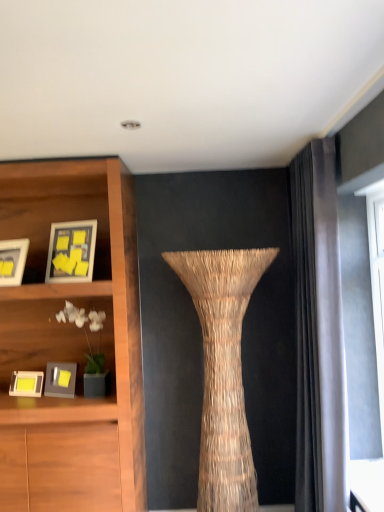
Question: From the image's perspective, is matte wooden picture frame at upper left, marked as the 4th picture frame in a bottom-to-top arrangement, on top of matte yellow picture frame at left, the 1th picture frame ordered from the bottom?

Choices:
 (A) no
 (B) yes

Answer: (B)

Question: Does matte wooden picture frame at upper left, marked as the 4th picture frame in a bottom-to-top arrangement, appear on the right side of matte yellow picture frame at left, positioned as the fourth picture frame in top-to-bottom order?

Choices:
 (A) yes
 (B) no

Answer: (A)

Question: From a real-world perspective, is matte wooden picture frame at upper left, positioned as the first picture frame in top-to-bottom order, on matte yellow picture frame at left, the 1th picture frame ordered from the bottom?

Choices:
 (A) no
 (B) yes

Answer: (B)

Question: Is matte wooden picture frame at upper left, positioned as the first picture frame in top-to-bottom order, in front of matte yellow picture frame at left, the 1th picture frame ordered from the bottom?

Choices:
 (A) no
 (B) yes

Answer: (B)

Question: Does matte wooden picture frame at upper left, marked as the 4th picture frame in a bottom-to-top arrangement, have a greater height compared to matte yellow picture frame at left, positioned as the fourth picture frame in top-to-bottom order?

Choices:
 (A) yes
 (B) no

Answer: (A)

Question: From the image's perspective, relative to natural fiber vase at center, is matte gray picture frame at lower left, the 2th picture frame when ordered from bottom to top, above or below?

Choices:
 (A) below
 (B) above

Answer: (B)

Question: From their relative heights in the image, would you say matte gray picture frame at lower left, arranged as the third picture frame when viewed from the top, is taller or shorter than natural fiber vase at center?

Choices:
 (A) tall
 (B) short

Answer: (B)

Question: Is point (46, 372) positioned closer to the camera than point (240, 266)?

Choices:
 (A) closer
 (B) farther

Answer: (B)

Question: Considering their positions, is matte gray picture frame at lower left, arranged as the third picture frame when viewed from the top, located in front of or behind natural fiber vase at center?

Choices:
 (A) front
 (B) behind

Answer: (B)

Question: Looking at the image, does matte white picture frame at left, placed as the second picture frame when sorted from top to bottom, seem bigger or smaller compared to matte gray picture frame at lower left, arranged as the third picture frame when viewed from the top?

Choices:
 (A) small
 (B) big

Answer: (B)

Question: Considering the positions of matte white picture frame at left, which ranks as the third picture frame in bottom-to-top order, and matte gray picture frame at lower left, arranged as the third picture frame when viewed from the top, in the image, is matte white picture frame at left, which ranks as the third picture frame in bottom-to-top order, taller or shorter than matte gray picture frame at lower left, arranged as the third picture frame when viewed from the top,?

Choices:
 (A) tall
 (B) short

Answer: (A)

Question: Would you say matte white picture frame at left, which ranks as the third picture frame in bottom-to-top order, is inside or outside matte gray picture frame at lower left, arranged as the third picture frame when viewed from the top?

Choices:
 (A) inside
 (B) outside

Answer: (B)

Question: From a real-world perspective, relative to matte gray picture frame at lower left, arranged as the third picture frame when viewed from the top, is matte white picture frame at left, which ranks as the third picture frame in bottom-to-top order, vertically above or below?

Choices:
 (A) above
 (B) below

Answer: (A)

Question: Visually, is matte wooden picture frame at upper left, marked as the 4th picture frame in a bottom-to-top arrangement, positioned to the left or to the right of matte yellow picture frame at left, the 1th picture frame ordered from the bottom?

Choices:
 (A) left
 (B) right

Answer: (B)

Question: Is matte wooden picture frame at upper left, positioned as the first picture frame in top-to-bottom order, wider or thinner than matte yellow picture frame at left, the 1th picture frame ordered from the bottom?

Choices:
 (A) thin
 (B) wide

Answer: (A)